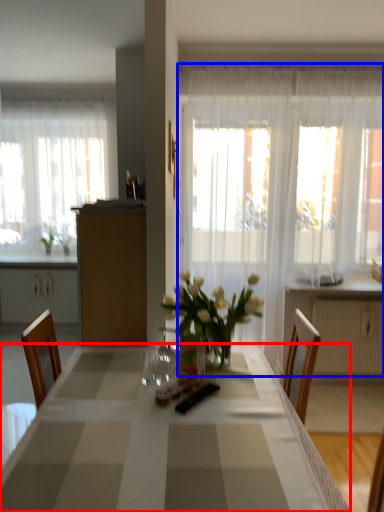
Question: Which object appears farthest to the camera in this image, desk (highlighted by a red box) or curtain (highlighted by a blue box)?

Choices:
 (A) desk
 (B) curtain

Answer: (B)